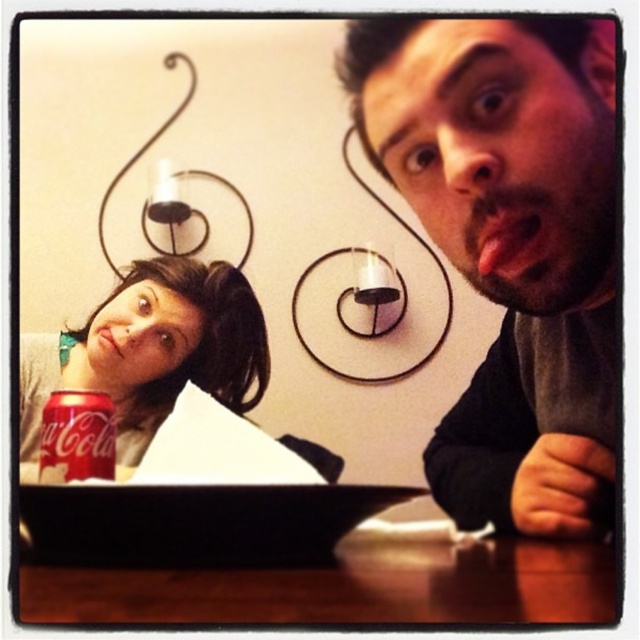
Can you confirm if matte red can at lower left is positioned above smooth pink tongue at center?

Actually, matte red can at lower left is below smooth pink tongue at center.

Who is more forward, (237,285) or (540,269)?

Point (540,269) is in front.

Which is in front, point (99, 374) or point (488, 204)?

Positioned in front is point (488, 204).

You are a GUI agent. You are given a task and a screenshot of the screen. Output one action in this format:
    pyautogui.click(x=<x>, y=<y>)
    Task: Click on the matte red can at lower left
    This screenshot has height=640, width=640.
    Given the screenshot: What is the action you would take?
    pyautogui.click(x=152, y=353)

Between red matte coca-cola can at lower left and matte skin mouth at lower left, which one appears on the right side from the viewer's perspective?

red matte coca-cola can at lower left

Image resolution: width=640 pixels, height=640 pixels. Identify the location of red matte coca-cola can at lower left. (76, 436).

You are a GUI agent. You are given a task and a screenshot of the screen. Output one action in this format:
    pyautogui.click(x=<x>, y=<y>)
    Task: Click on the red matte coca-cola can at lower left
    The image size is (640, 640).
    Given the screenshot: What is the action you would take?
    pyautogui.click(x=76, y=436)

At what (x,y) coordinates should I click in order to perform the action: click on red matte coca-cola can at lower left. Please return your answer as a coordinate pair (x, y). Image resolution: width=640 pixels, height=640 pixels. Looking at the image, I should click on (76, 436).

The height and width of the screenshot is (640, 640). What do you see at coordinates (344, 588) in the screenshot? I see `wooden table at lower center` at bounding box center [344, 588].

Is point (28, 588) positioned after point (548, 221)?

No, (28, 588) is in front of (548, 221).

The image size is (640, 640). Describe the element at coordinates (344, 588) in the screenshot. I see `wooden table at lower center` at that location.

At what (x,y) coordinates should I click in order to perform the action: click on wooden table at lower center. Please return your answer as a coordinate pair (x, y). The width and height of the screenshot is (640, 640). Looking at the image, I should click on (344, 588).